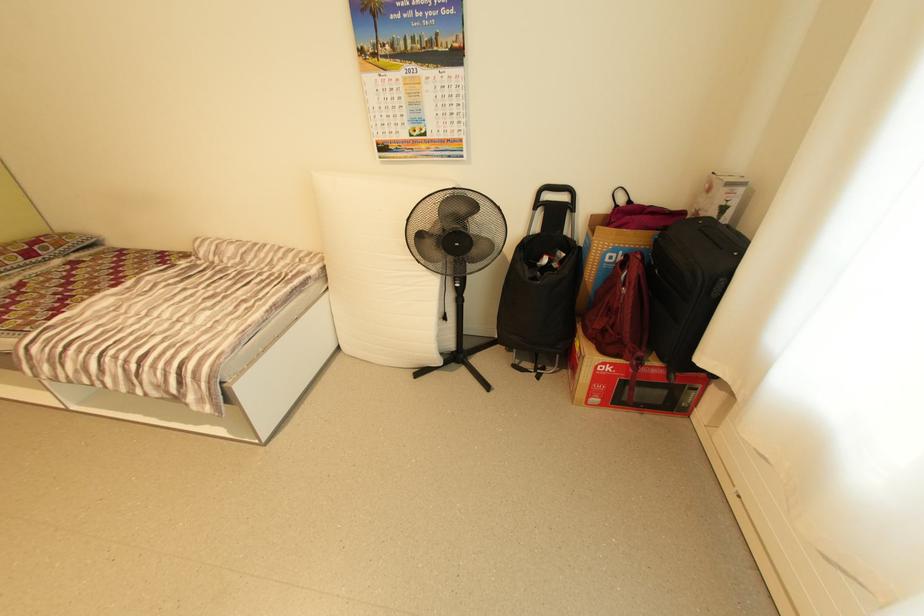
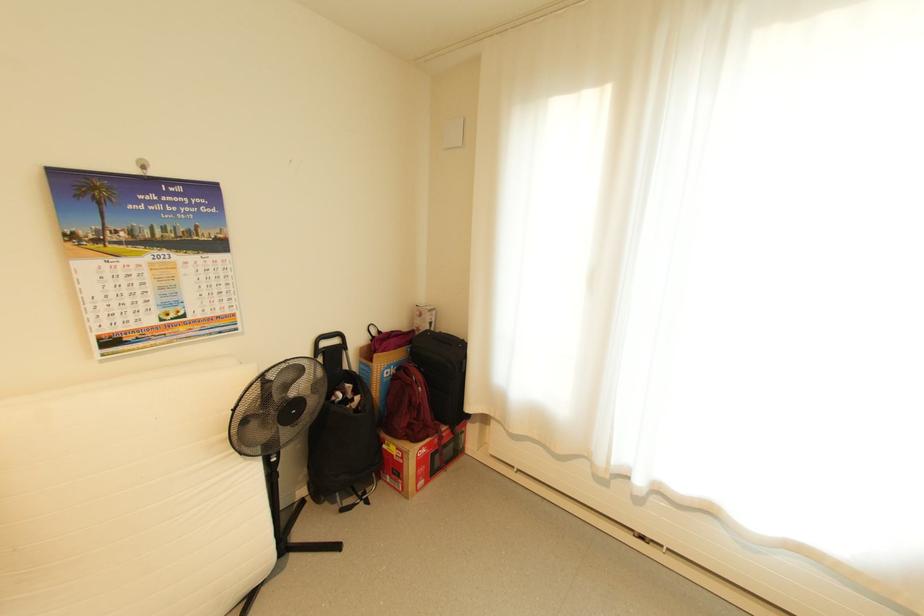
The point at (627, 253) is marked in the first image. Where is the corresponding point in the second image?

(398, 368)